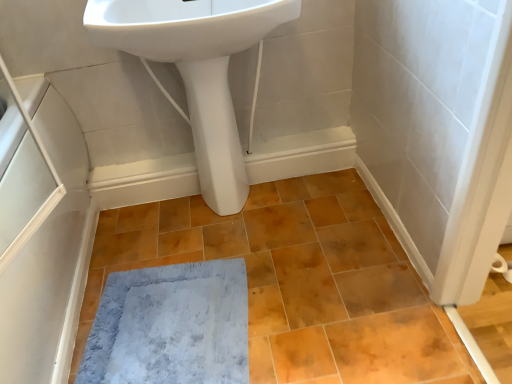
Question: From the image's perspective, relative to white glossy pedestal at center, is gray plush bath mat at lower center above or below?

Choices:
 (A) above
 (B) below

Answer: (B)

Question: In the image, is gray plush bath mat at lower center on the left side or the right side of white glossy pedestal at center?

Choices:
 (A) left
 (B) right

Answer: (A)

Question: Considering the real-world distances, which object is farthest from the gray plush bath mat at lower center?

Choices:
 (A) white glossy pedestal at center
 (B) white glossy sink at upper center
 (C) matte orange ceramic tile at center
 (D) white matte screen door at left

Answer: (B)

Question: Which of these objects is positioned farthest from the white glossy pedestal at center?

Choices:
 (A) gray plush bath mat at lower center
 (B) white matte screen door at left
 (C) matte orange ceramic tile at center
 (D) white glossy sink at upper center

Answer: (B)